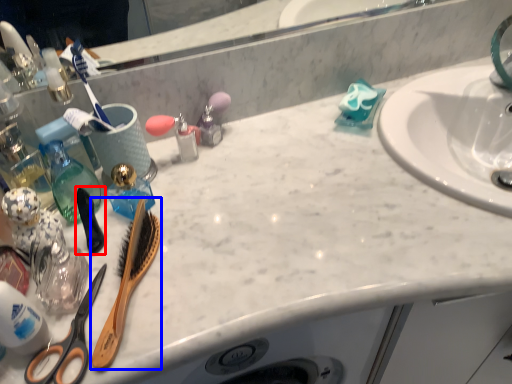
Question: Which of the following is the farthest to the observer, brush (highlighted by a red box) or brush (highlighted by a blue box)?

Choices:
 (A) brush
 (B) brush

Answer: (A)